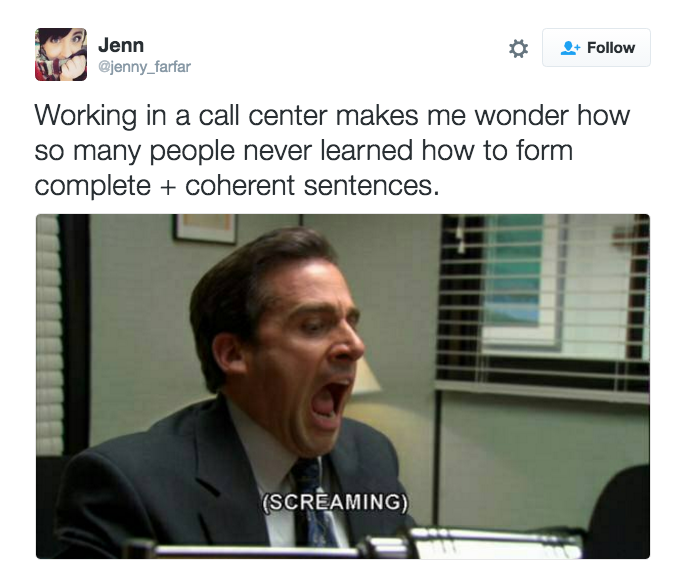
Image resolution: width=693 pixels, height=574 pixels. Identify the location of picture on wall. (216, 232), (195, 230), (211, 222).